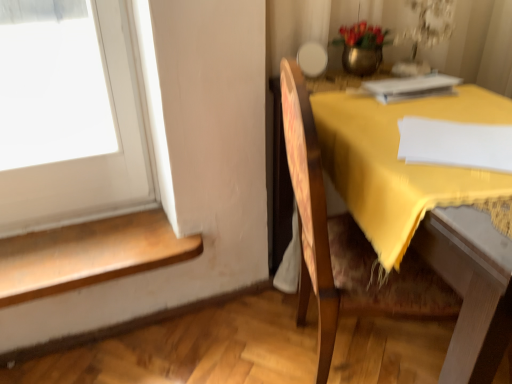
Question: Visually, is wooden step at lower left positioned to the left or to the right of white paper at upper right?

Choices:
 (A) left
 (B) right

Answer: (A)

Question: In terms of width, does wooden step at lower left look wider or thinner when compared to white paper at upper right?

Choices:
 (A) thin
 (B) wide

Answer: (B)

Question: Considering the real-world distances, which object is closest to the wooden chair at right?

Choices:
 (A) wooden step at lower left
 (B) metallic vase at upper center
 (C) white paper at upper right
 (D) yellow fabric at right

Answer: (D)

Question: Which is farther from the wooden step at lower left?

Choices:
 (A) wooden chair at right
 (B) white paper at upper right
 (C) yellow fabric at right
 (D) metallic vase at upper center

Answer: (D)